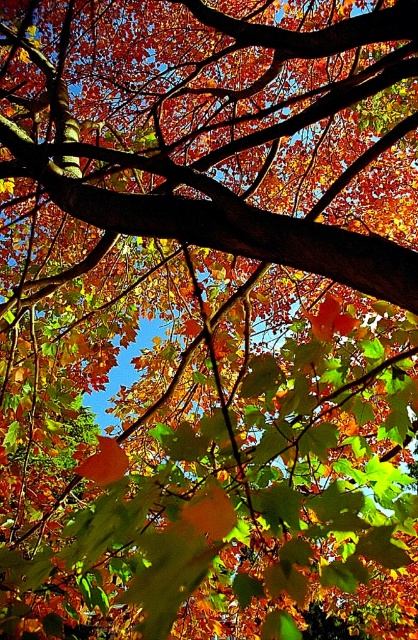
Question: Among these points, which one is nearest to the camera?

Choices:
 (A) (89, 465)
 (B) (97, 216)

Answer: (B)

Question: Is smooth brown branch at center in front of orange matte maple leaf at center?

Choices:
 (A) yes
 (B) no

Answer: (A)

Question: Where is smooth brown branch at center located in relation to orange matte maple leaf at center in the image?

Choices:
 (A) below
 (B) above

Answer: (B)

Question: Observing the image, what is the correct spatial positioning of smooth brown branch at center in reference to orange matte maple leaf at center?

Choices:
 (A) right
 (B) left

Answer: (A)

Question: Which point is farther to the camera?

Choices:
 (A) (109, 472)
 (B) (328, 256)

Answer: (A)